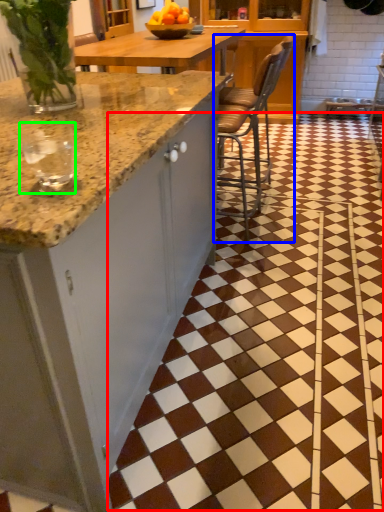
Question: Which object is positioned farthest from tile (highlighted by a red box)? Select from chair (highlighted by a blue box) and wine glass (highlighted by a green box).

Choices:
 (A) chair
 (B) wine glass

Answer: (B)